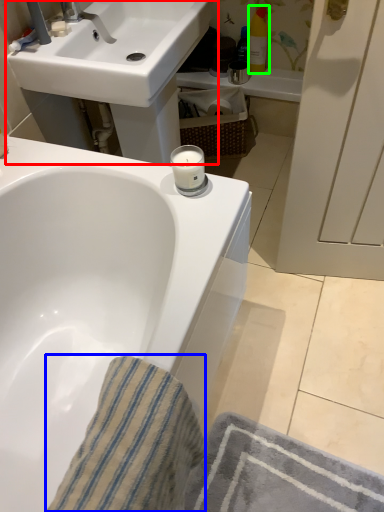
Question: Which is nearer to the sink (highlighted by a red box)? bath towel (highlighted by a blue box) or toiletry (highlighted by a green box).

Choices:
 (A) bath towel
 (B) toiletry

Answer: (B)